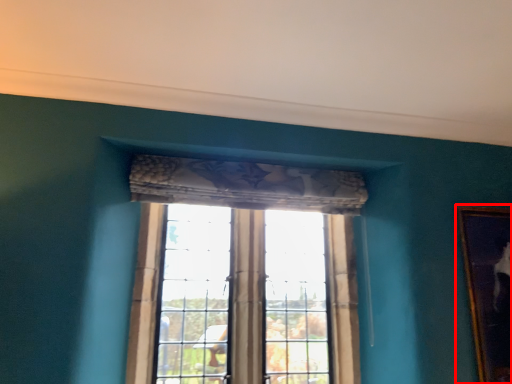
Question: From the image's perspective, where is picture frame (annotated by the red box) located in relation to window in the image?

Choices:
 (A) below
 (B) above

Answer: (B)